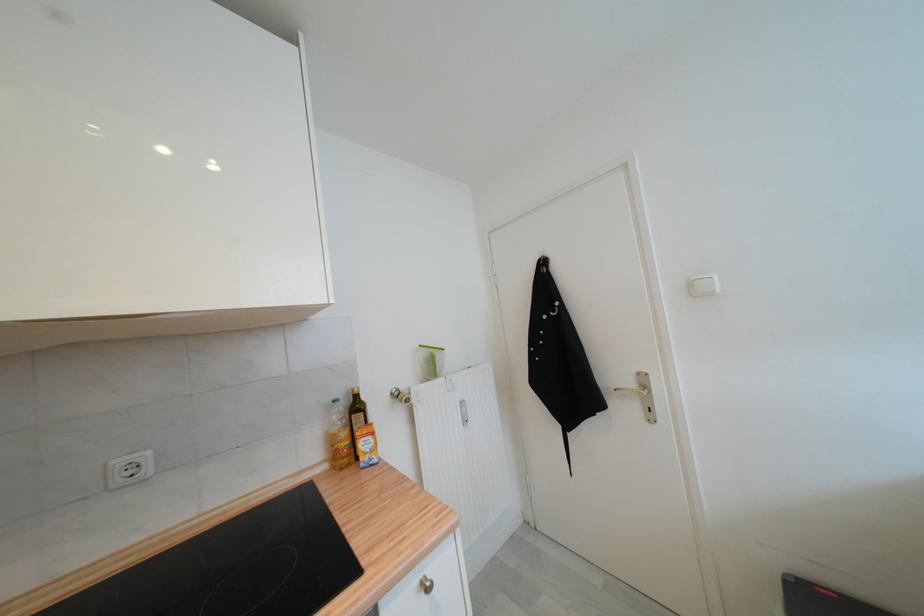
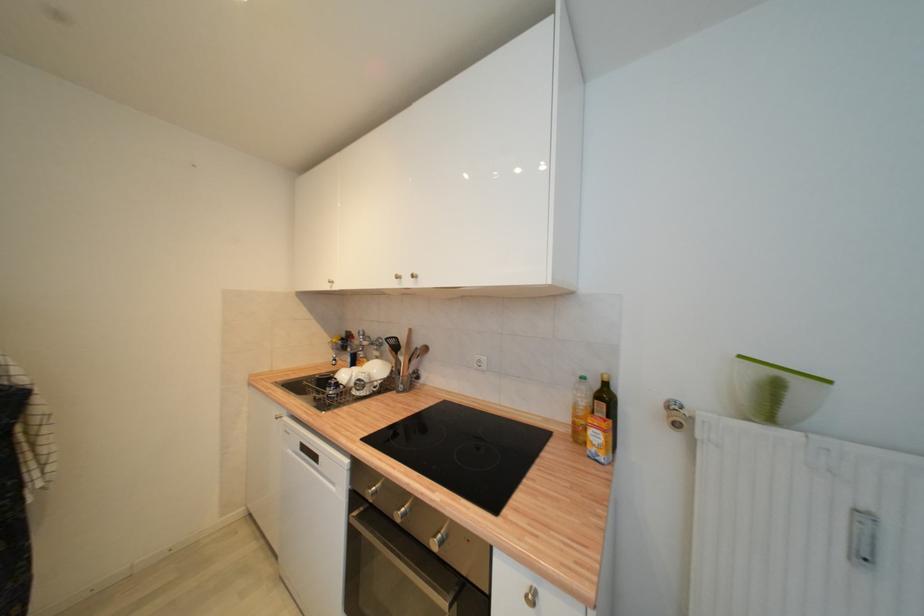
Locate, in the second image, the point that corresponds to (x=351, y=415) in the first image.

(596, 397)